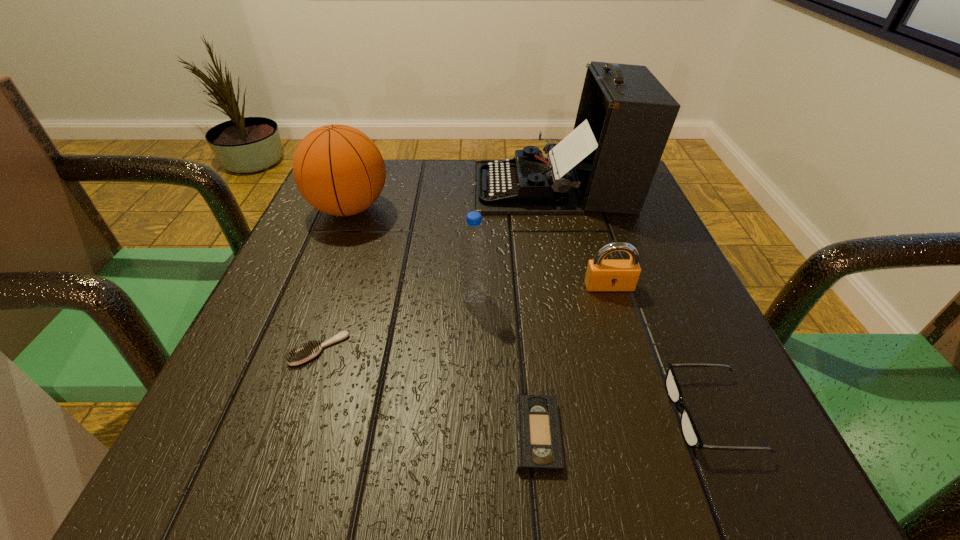
The width and height of the screenshot is (960, 540). In order to click on basketball that is positioned at the far edge in this screenshot , I will do `click(338, 169)`.

This screenshot has height=540, width=960. I want to click on spectacles at the near edge, so click(x=690, y=433).

Where is `videotape that is at the near edge`? The image size is (960, 540). videotape that is at the near edge is located at coordinates (538, 438).

Where is `basketball that is at the left edge`? basketball that is at the left edge is located at coordinates (338, 169).

Where is `scrubbing brush positioned at the left edge`? This screenshot has width=960, height=540. scrubbing brush positioned at the left edge is located at coordinates (313, 348).

At what (x,y) coordinates should I click in order to perform the action: click on typewriter located in the right edge section of the desktop. Please return your answer as a coordinate pair (x, y). This screenshot has height=540, width=960. Looking at the image, I should click on (607, 163).

In order to click on padlock that is positioned at the right edge in this screenshot , I will do `click(602, 274)`.

Locate an element on the screen. This screenshot has height=540, width=960. spectacles present at the right edge is located at coordinates (690, 433).

In order to click on object positioned at the far left corner in this screenshot , I will do `click(338, 169)`.

Identify the location of object present at the far right corner. pos(607,163).